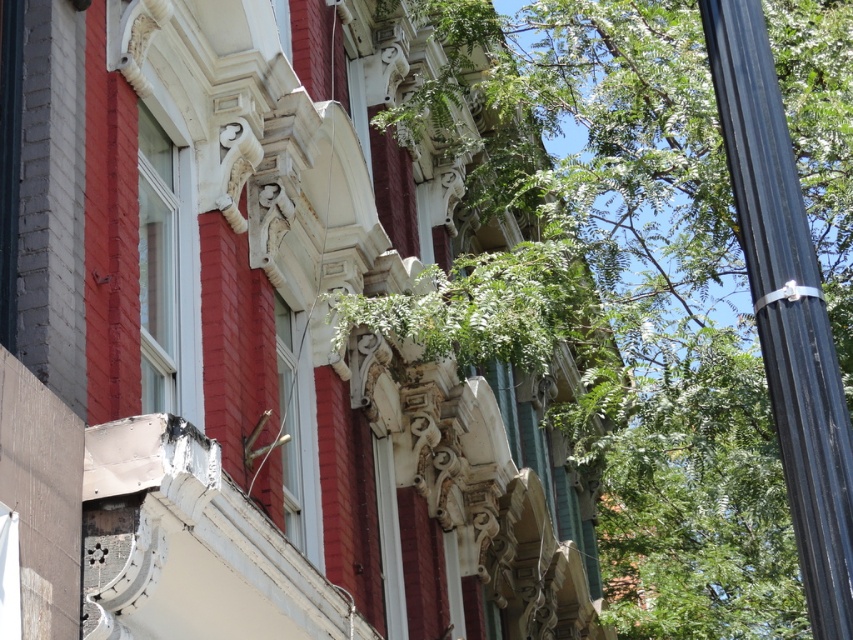
Based on the photo, you are standing in front of the red brick building and want to take a photo of the black metallic pole at right and the green leafy tree at center. Which object should you place on the left side of your camera frame to include both in the picture?

You should place the black metallic pole at right on the left side of your camera frame because the green leafy tree at center is positioned on the right side of it.

You are standing in front of a red brick building with ornate details and want to take a photo of the green leafy tree at center. If your camera can focus on objects up to 15 meters away, will you be able to capture a clear photo of the tree?

The green leafy tree at center is 13.66 meters away from the viewer, which is within the camera focus range of up to 15 meters. Therefore, you can capture a clear photo of the tree.